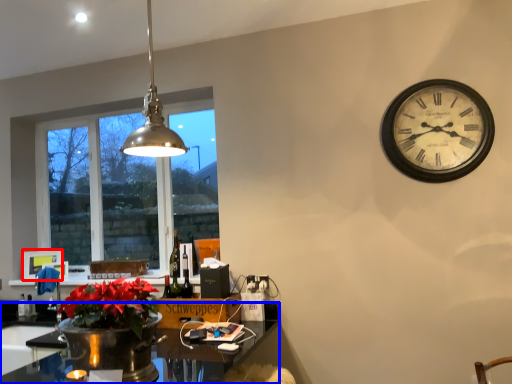
Question: Which object is further to the camera taking this photo, picture frame (highlighted by a red box) or desk (highlighted by a blue box)?

Choices:
 (A) picture frame
 (B) desk

Answer: (A)